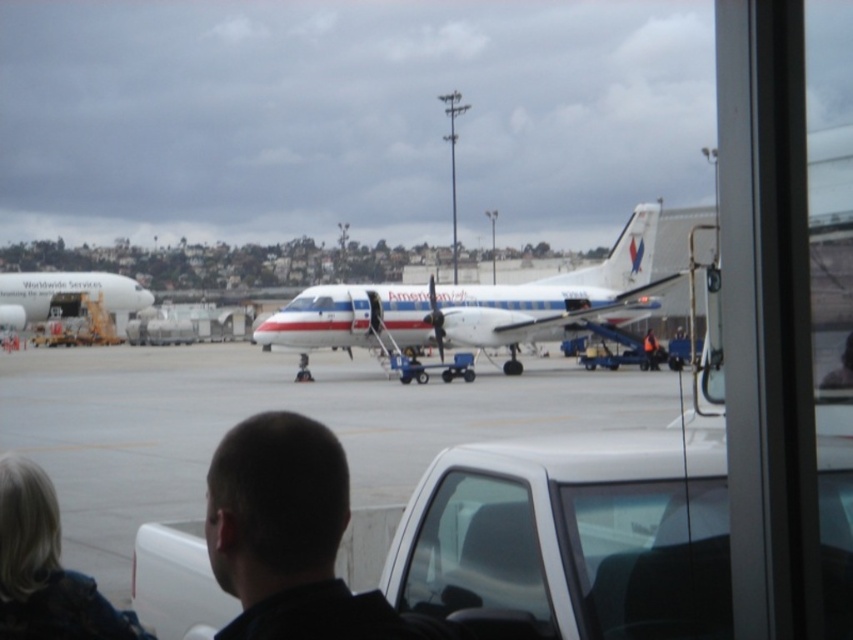
Can you confirm if gray concrete tarmac at center is smaller than dark hair at center?

No, gray concrete tarmac at center is not smaller than dark hair at center.

At what (x,y) coordinates should I click in order to perform the action: click on gray concrete tarmac at center. Please return your answer as a coordinate pair (x, y). Image resolution: width=853 pixels, height=640 pixels. Looking at the image, I should click on click(273, 406).

Between gray concrete tarmac at center and orange reflective vest at center, which one appears on the left side from the viewer's perspective?

Positioned to the left is gray concrete tarmac at center.

Which is behind, point (270, 360) or point (647, 364)?

The point (270, 360) is more distant.

Is point (16, 378) closer to camera compared to point (653, 333)?

That is True.

At what (x,y) coordinates should I click in order to perform the action: click on gray concrete tarmac at center. Please return your answer as a coordinate pair (x, y). The image size is (853, 640). Looking at the image, I should click on coord(273,406).

Is dark hair at center positioned at the back of transparent glass window at center?

No, dark hair at center is in front of transparent glass window at center.

Which is more to the left, dark hair at center or transparent glass window at center?

From the viewer's perspective, dark hair at center appears more on the left side.

Which is in front, point (309, 458) or point (418, 550)?

Point (309, 458) is in front.

You are a GUI agent. You are given a task and a screenshot of the screen. Output one action in this format:
    pyautogui.click(x=<x>, y=<y>)
    Task: Click on the dark hair at center
    
    Given the screenshot: What is the action you would take?
    pyautogui.click(x=289, y=536)